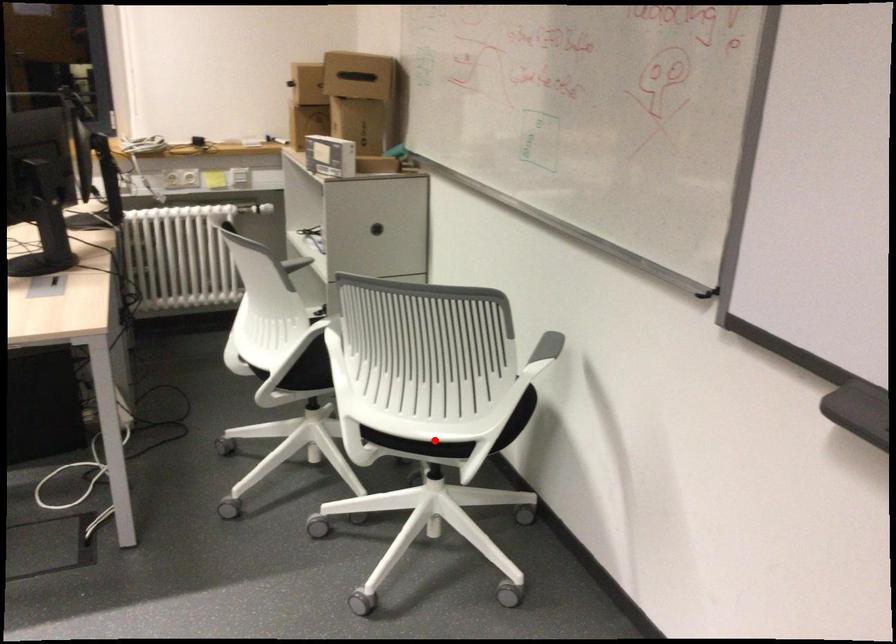
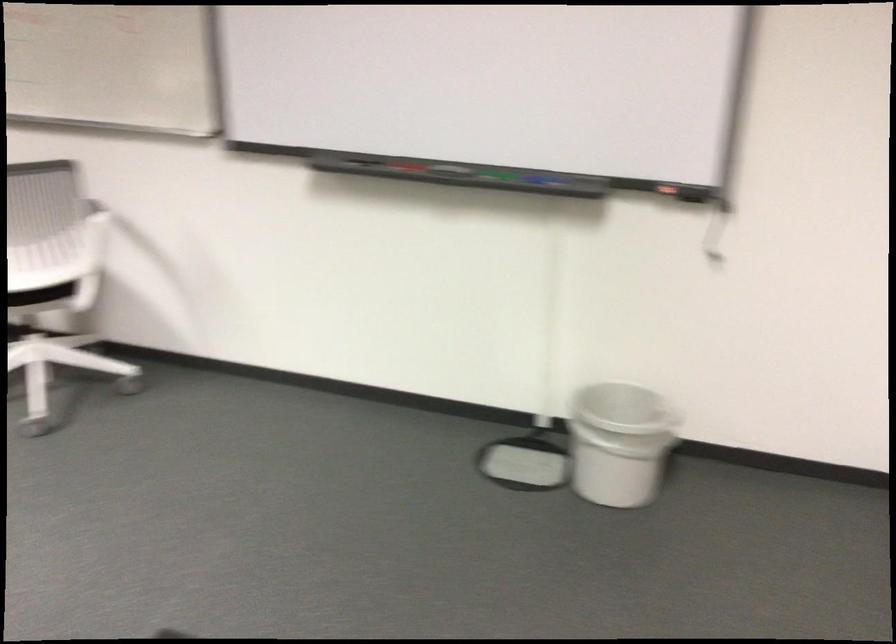
Locate, in the second image, the point that corresponds to the highlighted location in the first image.

(40, 295)